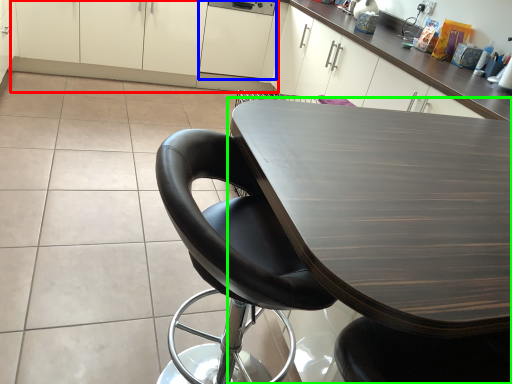
Question: Considering the real-world distances, which object is farthest from cabinetry (highlighted by a red box)? cabinetry (highlighted by a blue box) or table (highlighted by a green box)?

Choices:
 (A) cabinetry
 (B) table

Answer: (B)